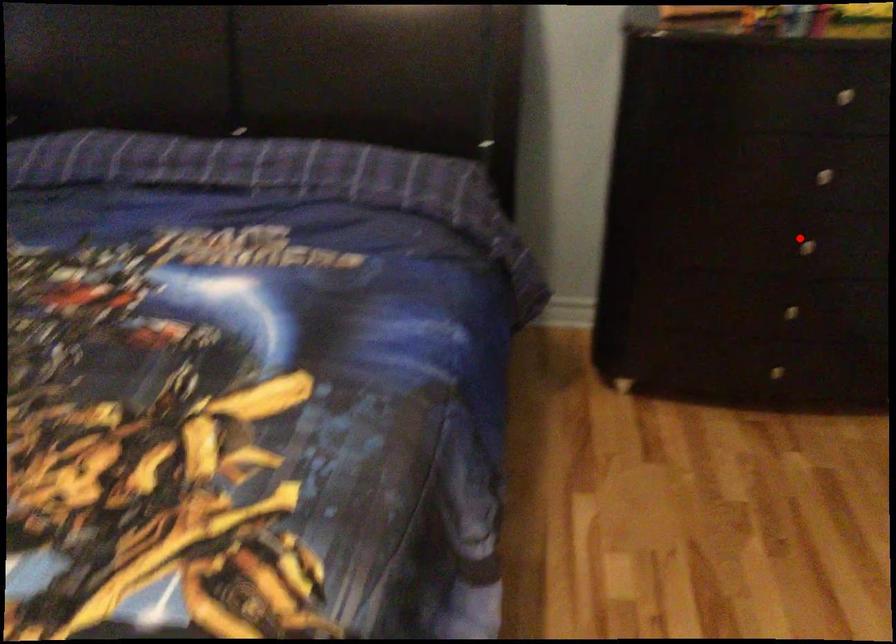
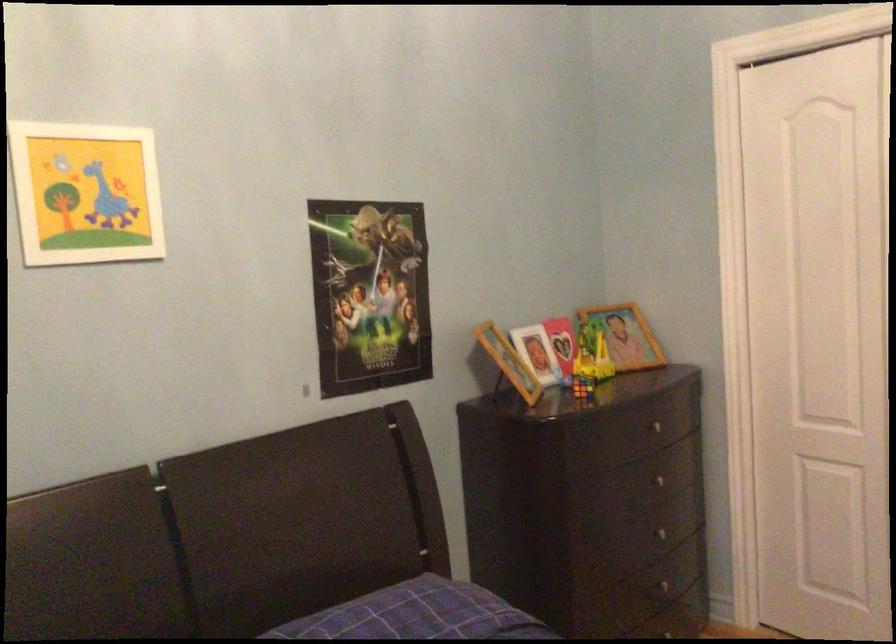
Question: I am providing you with two images of the same scene from different viewpoints. In image1, a red point is highlighted. Considering the same 3D point in image2, which of the following is correct?

Choices:
 (A) It is closer
 (B) It is farther

Answer: (B)